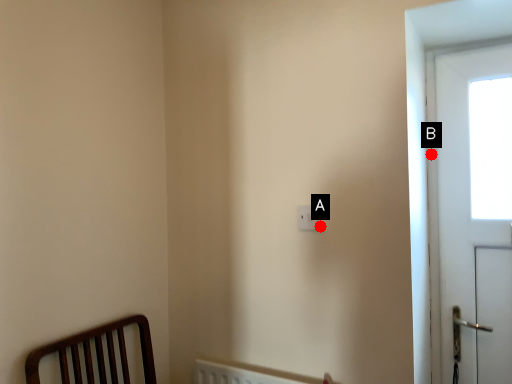
Question: Two points are circled on the image, labeled by A and B beside each circle. Which point is farther from the camera taking this photo?

Choices:
 (A) A is further
 (B) B is further

Answer: (B)